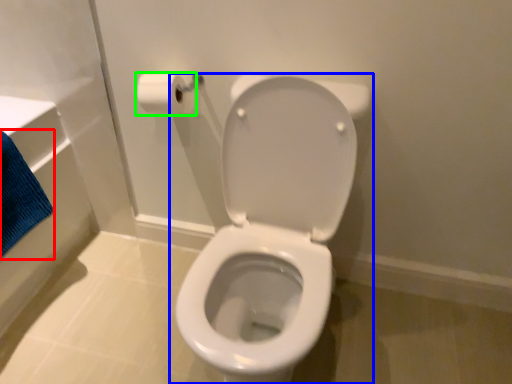
Question: Which object is positioned farthest from bath towel (highlighted by a red box)? Select from toilet (highlighted by a blue box) and toilet paper (highlighted by a green box).

Choices:
 (A) toilet
 (B) toilet paper

Answer: (A)